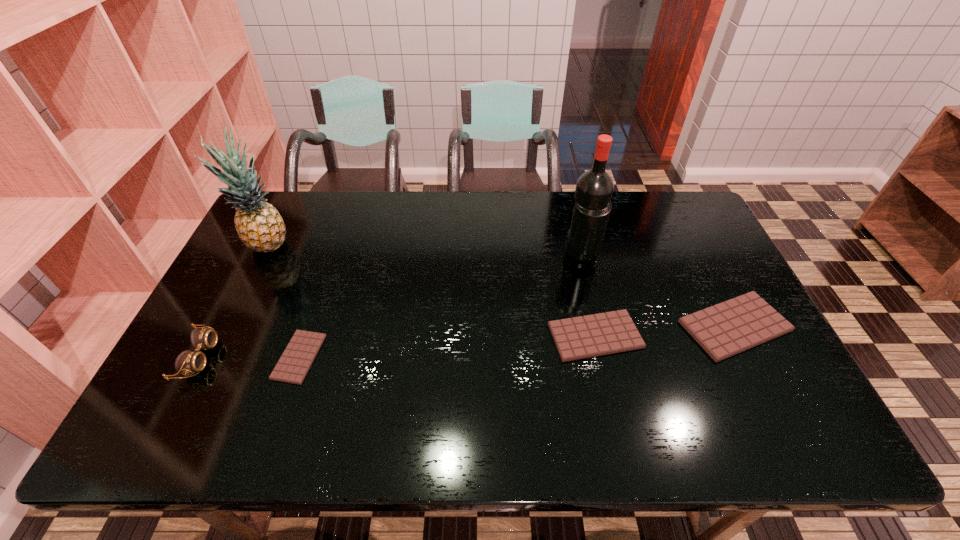
Image resolution: width=960 pixels, height=540 pixels. Find the location of `empty space that is in between the fourth shortest object and the rightmost chocolate bar`. empty space that is in between the fourth shortest object and the rightmost chocolate bar is located at coordinates (467, 342).

Find the location of a particular element. This screenshot has height=540, width=960. free spot between the fourth shortest object and the second chocolate bar from left to right is located at coordinates (397, 347).

You are a GUI agent. You are given a task and a screenshot of the screen. Output one action in this format:
    pyautogui.click(x=<x>, y=<y>)
    Task: Click on the vacant space that's between the second shortest chocolate bar and the leftmost chocolate bar
    The image size is (960, 540).
    Given the screenshot: What is the action you would take?
    pyautogui.click(x=447, y=346)

This screenshot has width=960, height=540. In order to click on free spot between the rightmost object and the pineapple in this screenshot , I will do `click(502, 287)`.

This screenshot has width=960, height=540. Identify the location of free spot between the wine bottle and the second shortest chocolate bar. (588, 294).

Where is `free space between the pineapple and the goggles`? free space between the pineapple and the goggles is located at coordinates (234, 302).

The image size is (960, 540). In order to click on vacant area between the wine bottle and the pineapple in this screenshot , I will do `click(426, 251)`.

This screenshot has width=960, height=540. What are the coordinates of `free spot between the rightmost chocolate bar and the shortest chocolate bar` in the screenshot? It's located at (517, 341).

Where is `object that stands as the fifth closest to the wine bottle`? The height and width of the screenshot is (540, 960). object that stands as the fifth closest to the wine bottle is located at coordinates (188, 362).

The image size is (960, 540). In order to click on object that ranks as the third closest to the leftmost chocolate bar in this screenshot , I will do `click(587, 336)`.